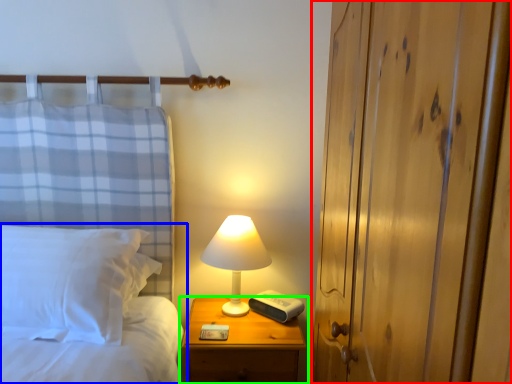
Question: Which object is the farthest from dresser (highlighted by a red box)? Choose among these: bed (highlighted by a blue box) or nightstand (highlighted by a green box).

Choices:
 (A) bed
 (B) nightstand

Answer: (A)